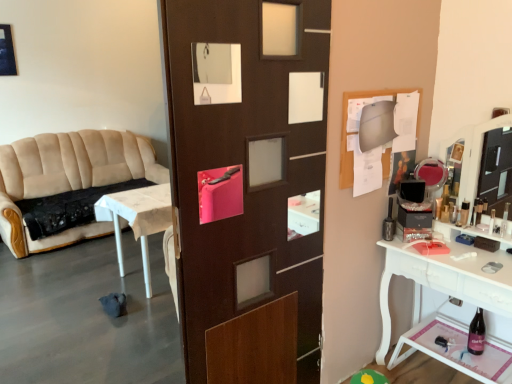
Question: Considering the positions of beige fabric couch at left and metallic silver toiletry at right, which is the second toiletry in right-to-left order, in the image, is beige fabric couch at left bigger or smaller than metallic silver toiletry at right, which is the second toiletry in right-to-left order,?

Choices:
 (A) small
 (B) big

Answer: (B)

Question: From the image's perspective, is beige fabric couch at left located above or below metallic silver toiletry at right, which is the 1th toiletry from left to right?

Choices:
 (A) below
 (B) above

Answer: (B)

Question: Which object is positioned farthest from the metallic silver toiletry at right, arranged as the first toiletry when viewed from the back?

Choices:
 (A) clear plastic bottle at right, which is the second toiletry in left-to-right order
 (B) beige fabric couch at left

Answer: (B)

Question: Which is nearer to the clear plastic bottle at right, placed as the first toiletry when sorted from front to back?

Choices:
 (A) metallic silver toiletry at right, which is the 1th toiletry from left to right
 (B) beige fabric couch at left

Answer: (A)